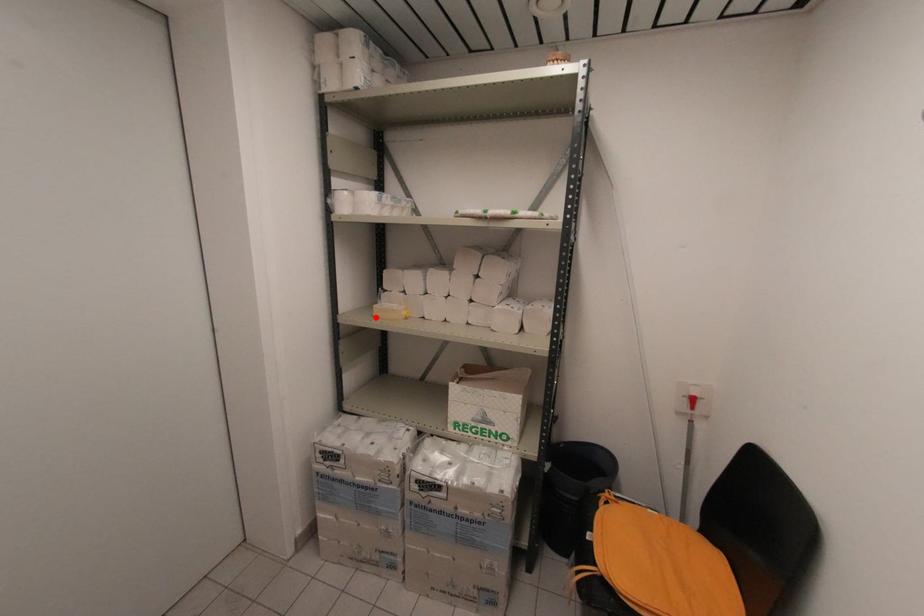
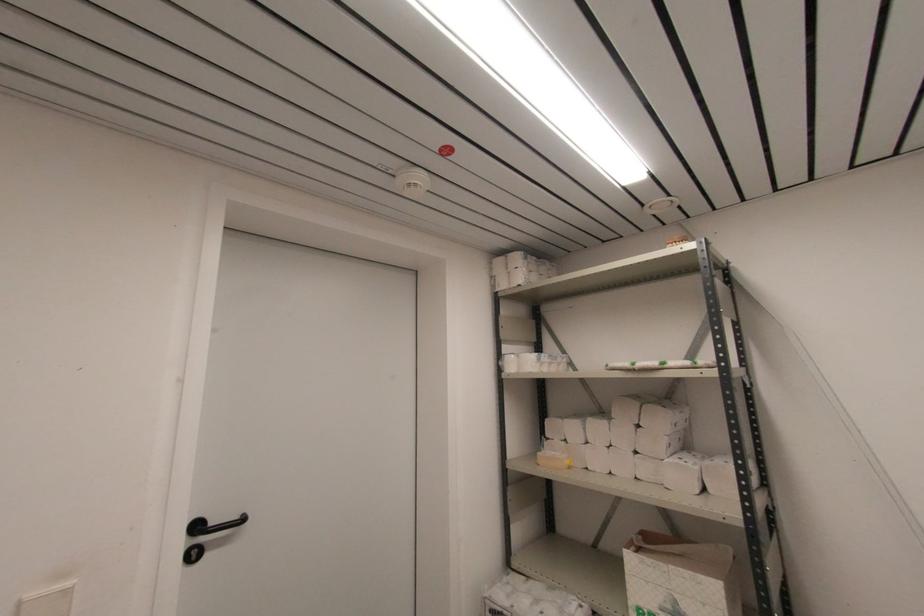
Question: I am providing you with two images of the same scene from different viewpoints. A red point is marked on the first image. At the location where the point appears in image 1, is it still visible in image 2?

Choices:
 (A) Yes
 (B) No

Answer: (A)